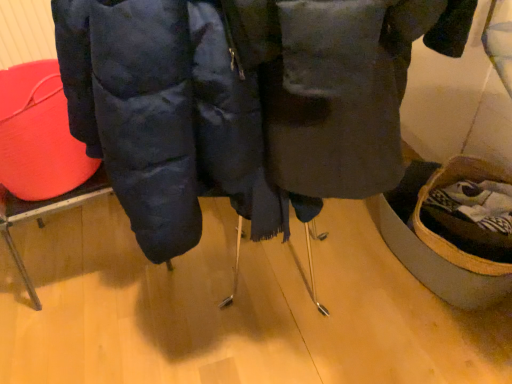
Question: Is matte blue jacket at center taller or shorter than rubberized red bucket at left?

Choices:
 (A) tall
 (B) short

Answer: (A)

Question: In terms of size, does matte blue jacket at center appear bigger or smaller than rubberized red bucket at left?

Choices:
 (A) big
 (B) small

Answer: (A)

Question: From a real-world perspective, is matte blue jacket at center positioned above or below rubberized red bucket at left?

Choices:
 (A) below
 (B) above

Answer: (B)

Question: Is point (9, 107) closer or farther from the camera than point (146, 56)?

Choices:
 (A) closer
 (B) farther

Answer: (B)

Question: Considering the positions of rubberized red bucket at left and matte blue jacket at center in the image, is rubberized red bucket at left taller or shorter than matte blue jacket at center?

Choices:
 (A) short
 (B) tall

Answer: (A)

Question: Is rubberized red bucket at left in front of or behind matte blue jacket at center in the image?

Choices:
 (A) front
 (B) behind

Answer: (B)

Question: From a real-world perspective, is rubberized red bucket at left above or below matte blue jacket at center?

Choices:
 (A) below
 (B) above

Answer: (A)